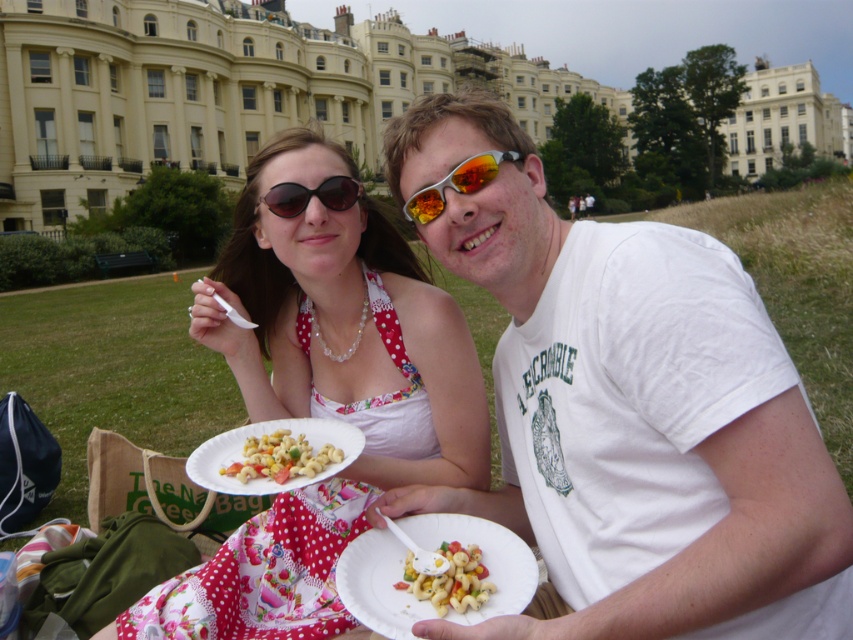
Question: Considering the relative positions of matte floral dress at center and black plastic sunglasses at upper center in the image provided, where is matte floral dress at center located with respect to black plastic sunglasses at upper center?

Choices:
 (A) left
 (B) right

Answer: (B)

Question: Observing the image, what is the correct spatial positioning of white paper plate at center in reference to white glossy pasta salad at center?

Choices:
 (A) below
 (B) above

Answer: (A)

Question: Which point is farther to the camera?

Choices:
 (A) black plastic sunglasses at upper center
 (B) multicolored pasta salad at center

Answer: (A)

Question: Is matte floral dress at center smaller than white paper plate at center?

Choices:
 (A) yes
 (B) no

Answer: (B)

Question: Which of the following is the farthest from the observer?

Choices:
 (A) white paper plate at center
 (B) matte floral dress at center
 (C) black plastic sunglasses at upper center
 (D) multicolored pasta salad at center

Answer: (C)

Question: Which of the following is the farthest from the observer?

Choices:
 (A) shiny reflective sunglasses at center
 (B) multicolored pasta salad at center
 (C) matte floral dress at center
 (D) white matte t-shirt at center

Answer: (A)